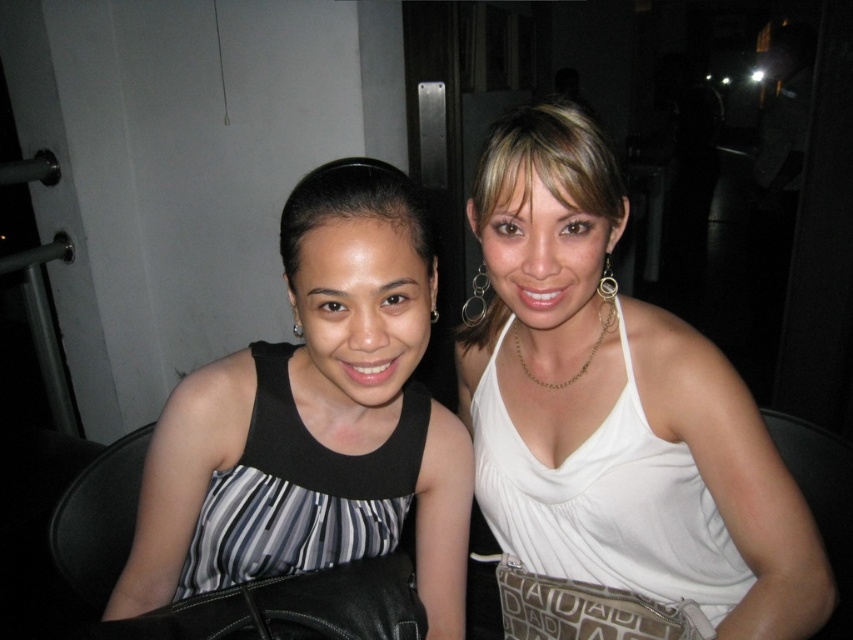
You are a photographer trying to capture a closeup shot of the gold metallic hoop at upper center without including the black striped dress at center in the frame. Given their sizes, is this feasible?

The black striped dress at center is larger in size than the gold metallic hoop at upper center, so it may be challenging to capture a closeup of the gold metallic hoop at upper center without including the black striped dress at center in the frame due to the dress being bigger and possibly obstructing the view.

You are standing in the same position as the photographer who took the picture. You want to place a small sticker on the image such that it covers the point labeled point (338, 436) but not the point labeled point (297, 330). Is this possible?

Yes, because point (338, 436) is behind point (297, 330), so placing the sticker over point (338, 436) would not obstruct point (297, 330).

You are a photographer who wants to ensure both the white satin tank top at center and the black striped dress at center are clearly visible in the photo. Given their current positions, which one might be more challenging to capture fully in the frame?

The black striped dress at center is behind the white satin tank top at center, so it might be more challenging to capture fully in the frame because it is obscured by the white satin tank top at center.